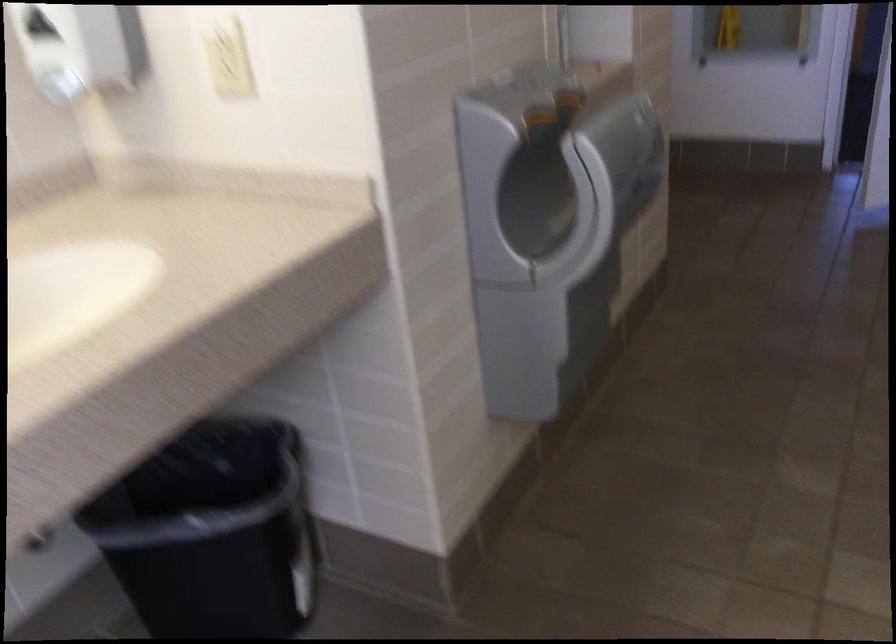
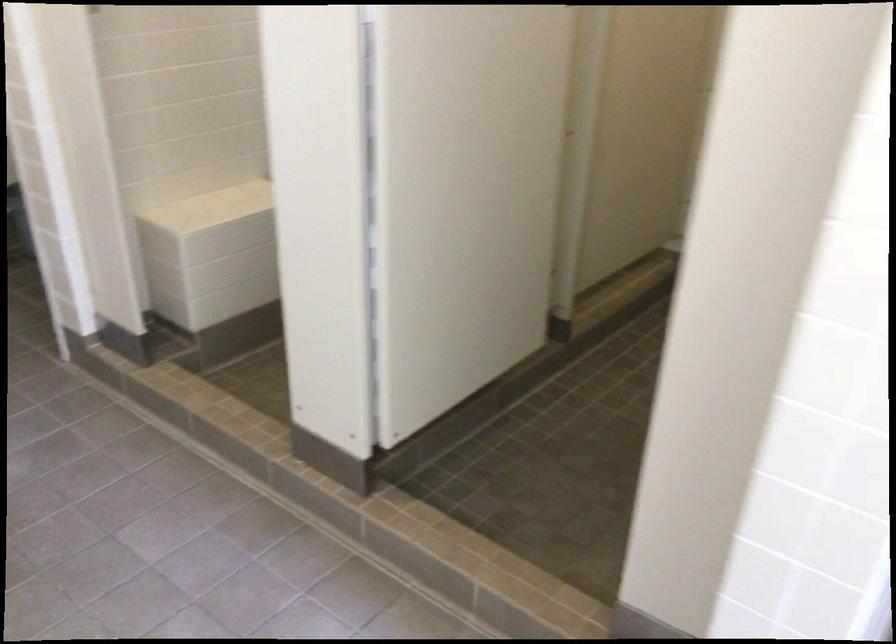
Question: The camera is either moving clockwise (left) or counter-clockwise (right) around the object. The first image is from the beginning of the video and the second image is from the end. Is the camera moving left or right when shooting the video?

Choices:
 (A) Left
 (B) Right

Answer: (A)